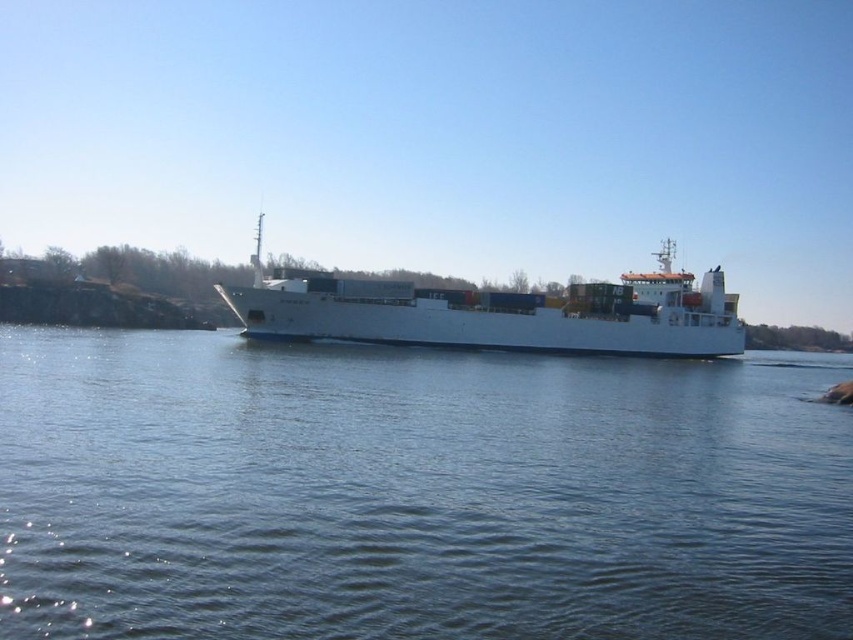
You are a photographer on a boat and want to capture the blue water at center and the white matte container ship at center in a single photo. Which object will take up more of the frame?

The white matte container ship at center occupies more space than the blue water at center, so it will take up more of the frame.

You are a sailor on the white matte container ship at center. You want to check the water level below the ship. Which direction should you look to see the blue water at center?

The blue water at center is located below the white matte container ship at center, so you should look downward to see the blue water at center.